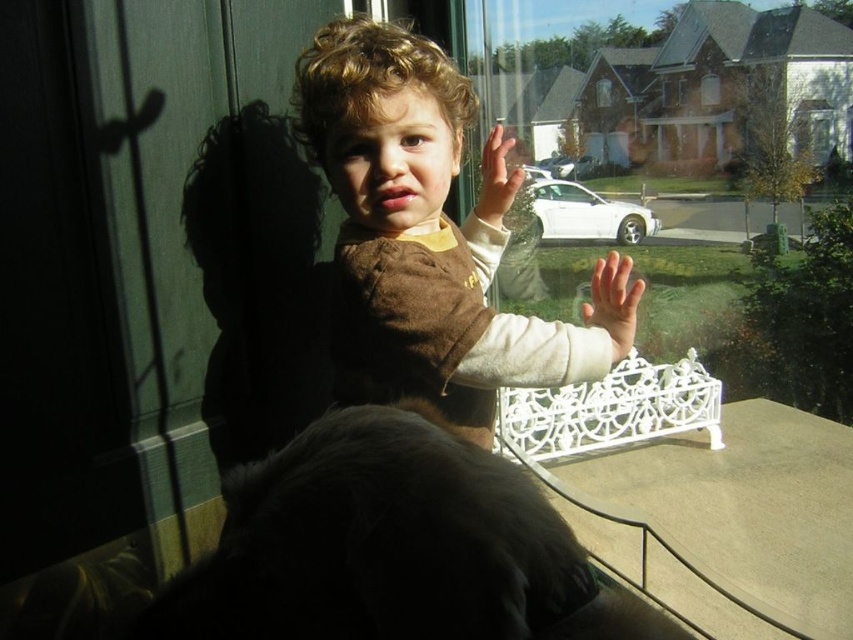
Question: Estimate the real-world distances between objects in this image. Which object is closer to the smooth skin hand at upper center?

Choices:
 (A) smooth skin hand at center
 (B) brown fuzzy sweater at center

Answer: (A)

Question: Does brown fuzzy sweater at center appear on the left side of smooth skin hand at center?

Choices:
 (A) no
 (B) yes

Answer: (B)

Question: Where is smooth skin hand at center located in relation to smooth skin hand at upper center in the image?

Choices:
 (A) below
 (B) above

Answer: (A)

Question: Which object is the farthest from the brown fuzzy sweater at center?

Choices:
 (A) smooth skin hand at center
 (B) smooth skin hand at upper center

Answer: (A)

Question: Which object is closer to the camera taking this photo?

Choices:
 (A) smooth skin hand at center
 (B) brown fuzzy sweater at center

Answer: (A)

Question: Can you confirm if brown fuzzy sweater at center is positioned to the left of smooth skin hand at upper center?

Choices:
 (A) yes
 (B) no

Answer: (A)